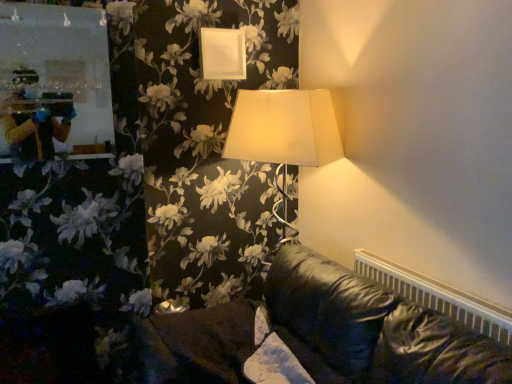
Question: Based on their sizes in the image, would you say white matte picture frame at upper center is bigger or smaller than white plastic radiator at lower right?

Choices:
 (A) big
 (B) small

Answer: (B)

Question: Would you say white matte picture frame at upper center is to the left or to the right of white plastic radiator at lower right in the picture?

Choices:
 (A) left
 (B) right

Answer: (A)

Question: From the image's perspective, is white matte picture frame at upper center positioned above or below white plastic radiator at lower right?

Choices:
 (A) above
 (B) below

Answer: (A)

Question: From the image's perspective, relative to white matte picture frame at upper center, is white plastic radiator at lower right above or below?

Choices:
 (A) above
 (B) below

Answer: (B)

Question: Is white plastic radiator at lower right inside the boundaries of white matte picture frame at upper center, or outside?

Choices:
 (A) inside
 (B) outside

Answer: (B)

Question: Is white plastic radiator at lower right in front of or behind white matte picture frame at upper center in the image?

Choices:
 (A) behind
 (B) front

Answer: (B)

Question: Considering the positions of point (495, 317) and point (226, 48), is point (495, 317) closer or farther from the camera than point (226, 48)?

Choices:
 (A) closer
 (B) farther

Answer: (A)